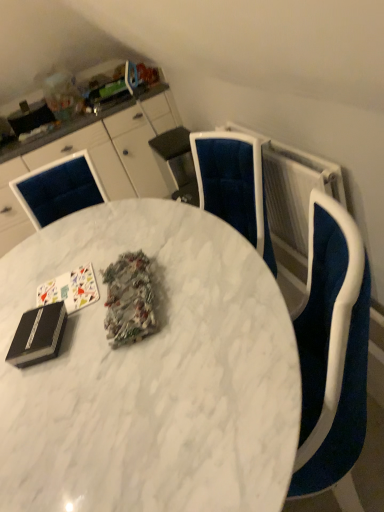
Where is `free space between shiny metallic foil at center and white matte card game at upper left`? free space between shiny metallic foil at center and white matte card game at upper left is located at coordinates (86, 313).